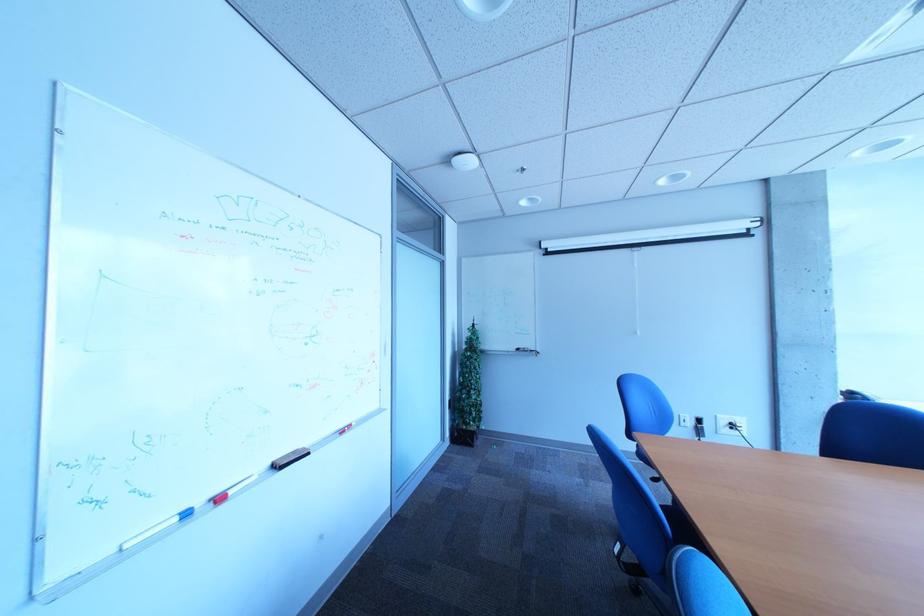
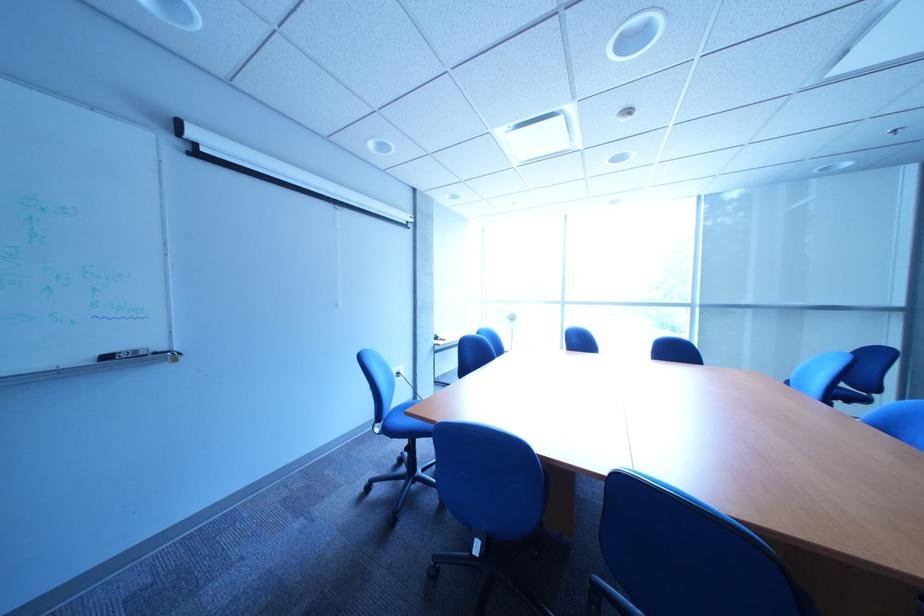
The point at (533, 351) is marked in the first image. Where is the corresponding point in the second image?

(123, 359)